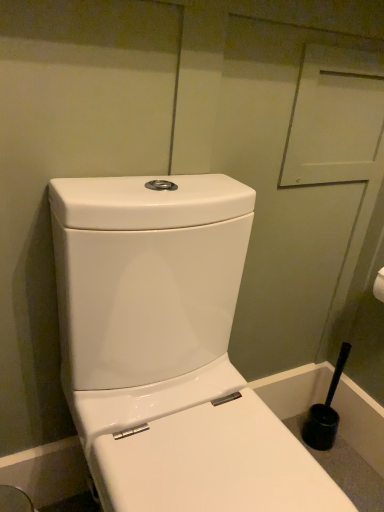
Question: Based on their positions, is white glossy toilet at center located to the left or right of black plastic toilet brush at lower right?

Choices:
 (A) right
 (B) left

Answer: (B)

Question: Considering the positions of white glossy toilet at center and black plastic toilet brush at lower right in the image, is white glossy toilet at center taller or shorter than black plastic toilet brush at lower right?

Choices:
 (A) short
 (B) tall

Answer: (B)

Question: In the image, is white glossy toilet at center positioned in front of or behind black plastic toilet brush at lower right?

Choices:
 (A) front
 (B) behind

Answer: (A)

Question: Based on their sizes in the image, would you say black plastic toilet brush at lower right is bigger or smaller than white glossy toilet at center?

Choices:
 (A) big
 (B) small

Answer: (B)

Question: Considering the positions of black plastic toilet brush at lower right and white glossy toilet at center in the image, is black plastic toilet brush at lower right taller or shorter than white glossy toilet at center?

Choices:
 (A) tall
 (B) short

Answer: (B)

Question: Looking at their shapes, would you say black plastic toilet brush at lower right is wider or thinner than white glossy toilet at center?

Choices:
 (A) wide
 (B) thin

Answer: (B)

Question: From the image's perspective, relative to white glossy toilet at center, is black plastic toilet brush at lower right above or below?

Choices:
 (A) above
 (B) below

Answer: (B)